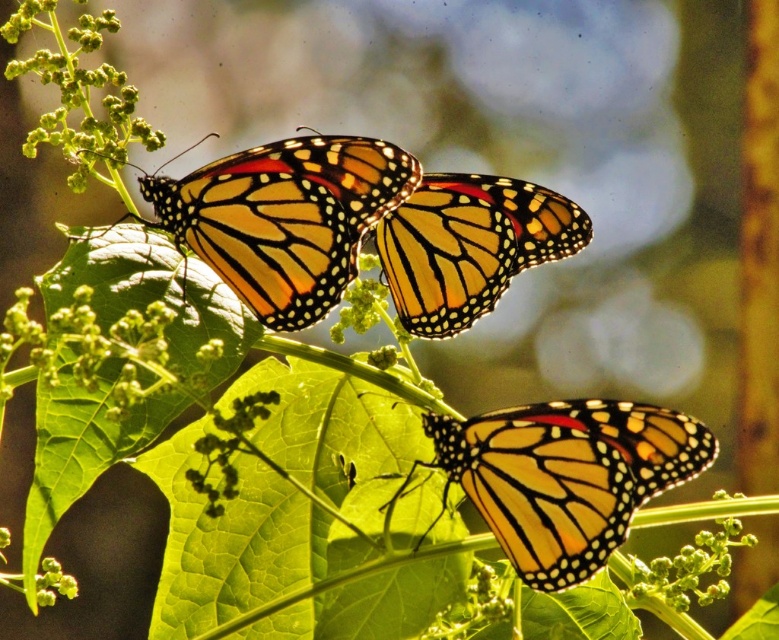
You are a photographer trying to capture a detailed shot of the Monarch butterflies. You notice two points of interest labeled as point (18, 28) and point (351, 300) on the image. Which point should you focus on first if you want to ensure the closest butterfly is in sharp focus?

Point (18, 28) is closer to the viewer than point (351, 300), so you should focus on point (18, 28) first to ensure the closest butterfly is in sharp focus.

You are a botanist examining a closeup of three Monarch butterflies on a leafy plant. You notice a point labeled with coordinates at the upper left corner of the image. What object is located at point (x=79, y=93)?

The point at (x=79, y=93) indicates a green fuzzy plant at upper left.